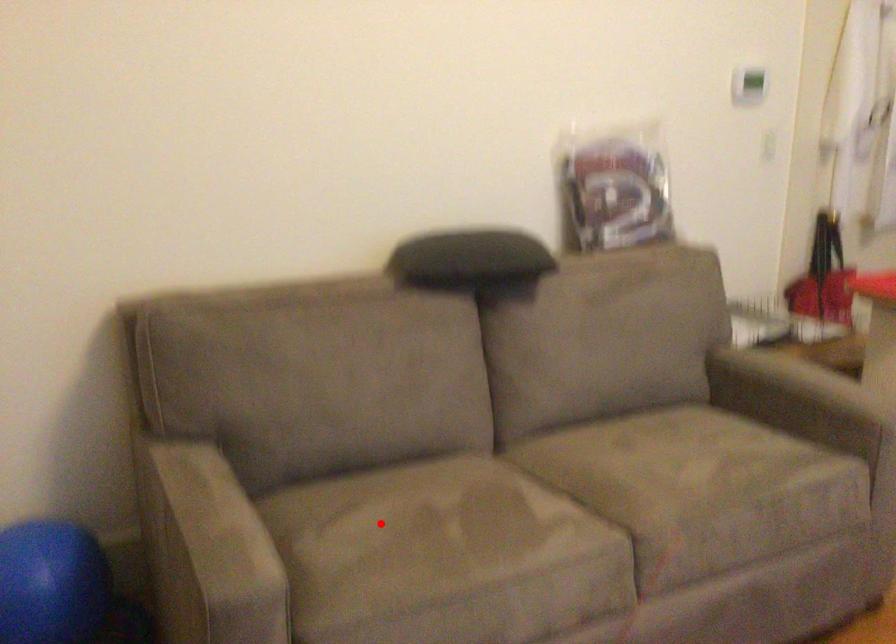
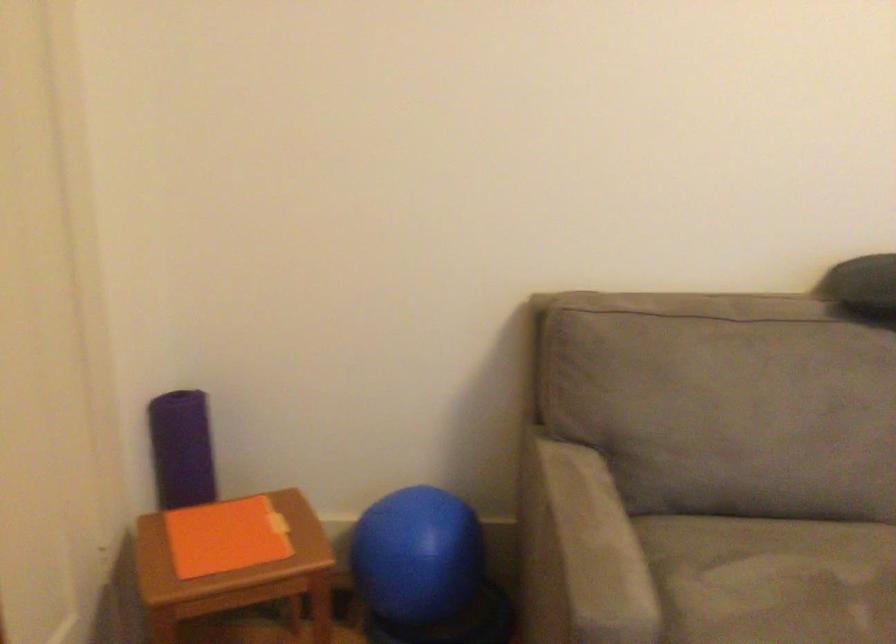
Question: I am providing you with two images of the same scene from different viewpoints. A red point is shown in image1. For the corresponding object point in image2, is it positioned nearer or farther from the camera?

Choices:
 (A) Nearer
 (B) Farther

Answer: (A)